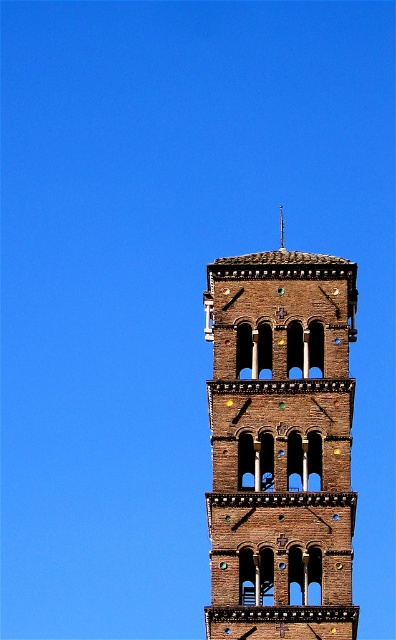
You are an architect analyzing the symmetry of the bell tower. You notice the brown brick tower at center and the brown stone spire at center. Which of these two structures is located to the left when viewed from the front?

The brown brick tower at center is positioned on the left side of the brown stone spire at center, so when viewed from the front, the brown brick tower at center is to the left of the brown stone spire at center.

You are standing at the base of the bell tower and looking upward. You notice two points marked on the tower. The first point is at coordinates point (293, 440) and the second is at point (279, 216). Which of these points appears closer to you when viewed from your current position?

Point (293, 440) is in front of point (279, 216), so it appears closer to you when viewed from your current position at the base of the bell tower.

You are an architect assessing the structural integrity of the brown brick tower at center and the brown stone spire at center. Which of the two has a greater surface area for potential repairs?

The brown brick tower at center has a greater surface area for potential repairs since it is larger in size than the brown stone spire at center.